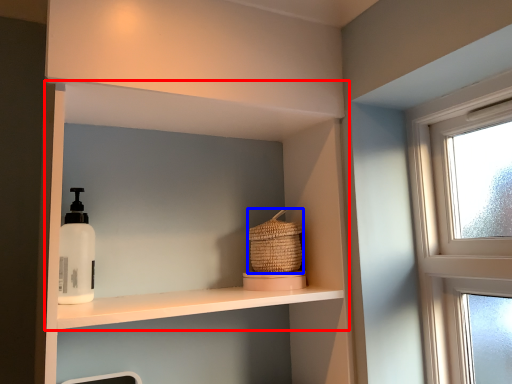
Question: Which object is closer to the camera taking this photo, shelf (highlighted by a red box) or basket (highlighted by a blue box)?

Choices:
 (A) shelf
 (B) basket

Answer: (A)